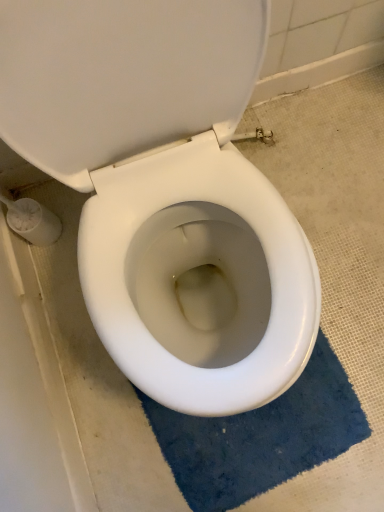
Question: From a real-world perspective, is white glossy toilet seat at center positioned above or below blue plush bath mat at lower center?

Choices:
 (A) above
 (B) below

Answer: (A)

Question: From the image's perspective, is white glossy toilet seat at center located above or below blue plush bath mat at lower center?

Choices:
 (A) above
 (B) below

Answer: (A)

Question: Looking at the image, does white glossy toilet seat at center seem bigger or smaller compared to blue plush bath mat at lower center?

Choices:
 (A) small
 (B) big

Answer: (A)

Question: Based on their sizes in the image, would you say blue plush bath mat at lower center is bigger or smaller than white glossy toilet seat at center?

Choices:
 (A) small
 (B) big

Answer: (B)

Question: Relative to white glossy toilet seat at center, is blue plush bath mat at lower center in front or behind?

Choices:
 (A) behind
 (B) front

Answer: (B)

Question: In terms of width, does blue plush bath mat at lower center look wider or thinner when compared to white glossy toilet seat at center?

Choices:
 (A) wide
 (B) thin

Answer: (A)

Question: From a real-world perspective, is blue plush bath mat at lower center physically located above or below white glossy toilet seat at center?

Choices:
 (A) below
 (B) above

Answer: (A)